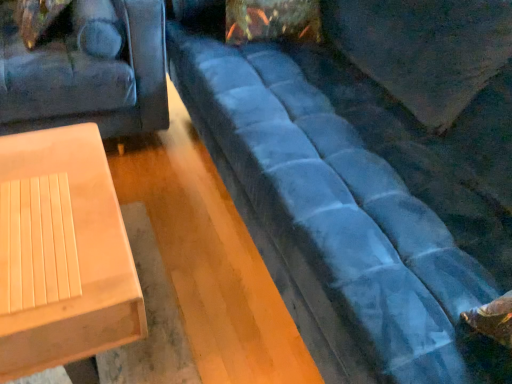
Question: In terms of width, does light wood/texture table at lower left look wider or thinner when compared to velvet blue couch at center?

Choices:
 (A) thin
 (B) wide

Answer: (A)

Question: Considering the relative positions of light wood/texture table at lower left and velvet blue couch at center in the image provided, is light wood/texture table at lower left to the left or to the right of velvet blue couch at center?

Choices:
 (A) right
 (B) left

Answer: (B)

Question: Is light wood/texture table at lower left situated inside velvet blue couch at center or outside?

Choices:
 (A) outside
 (B) inside

Answer: (A)

Question: From a real-world perspective, is velvet blue couch at center physically located above or below light wood/texture table at lower left?

Choices:
 (A) below
 (B) above

Answer: (B)

Question: Is velvet blue couch at center wider or thinner than light wood/texture table at lower left?

Choices:
 (A) thin
 (B) wide

Answer: (B)

Question: Is point (353, 292) closer or farther from the camera than point (28, 139)?

Choices:
 (A) closer
 (B) farther

Answer: (A)

Question: From the image's perspective, is velvet blue couch at center positioned above or below light wood/texture table at lower left?

Choices:
 (A) below
 (B) above

Answer: (B)